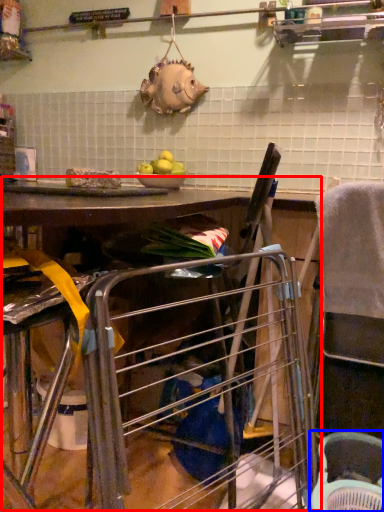
Question: Which point is further to the camera, workbench (highlighted by a red box) or basket (highlighted by a blue box)?

Choices:
 (A) workbench
 (B) basket

Answer: (B)